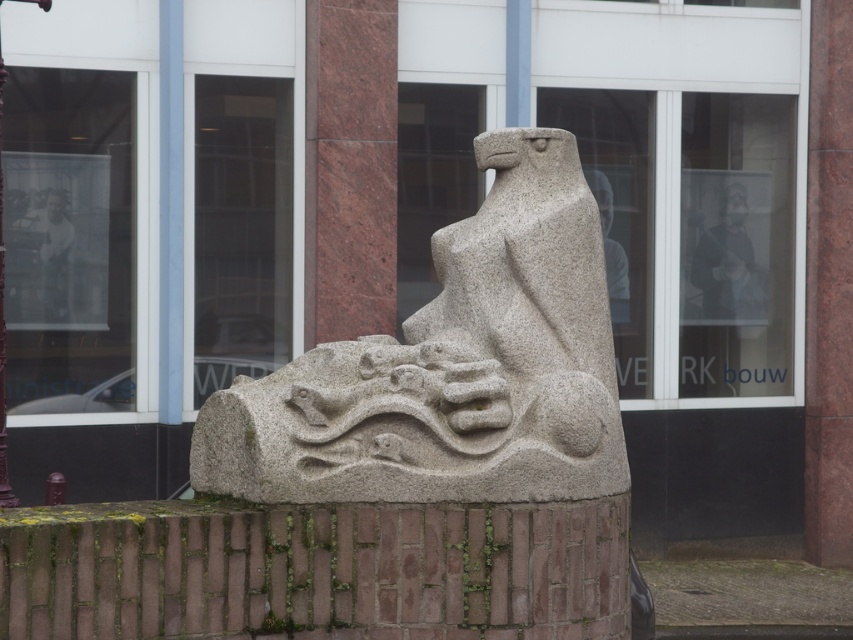
Based on the photo, is granite statue at center shorter than dark gray fabric jacket at upper center?

No, granite statue at center is not shorter than dark gray fabric jacket at upper center.

What are the coordinates of `granite statue at center` in the screenshot? It's located at (447, 433).

Is point (424, 362) farther from viewer compared to point (733, 307)?

That is False.

Identify the location of granite statue at center. Image resolution: width=853 pixels, height=640 pixels. (447, 433).